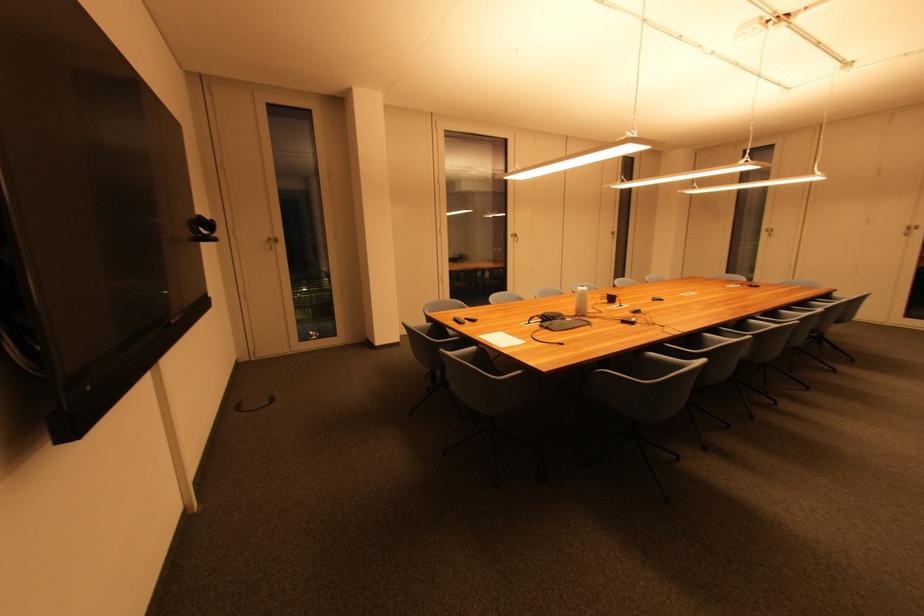
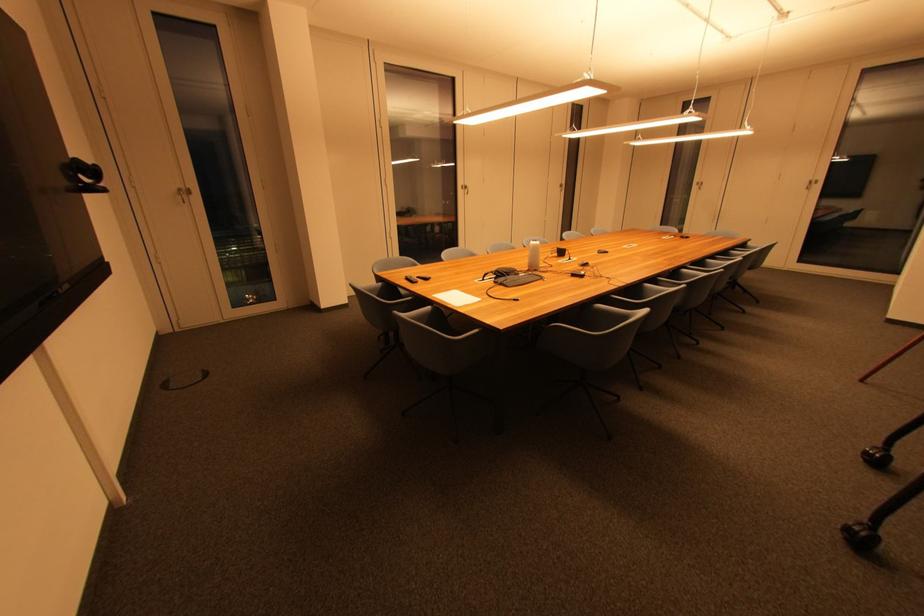
Locate, in the second image, the point that corresponds to (274,241) in the first image.

(185, 192)